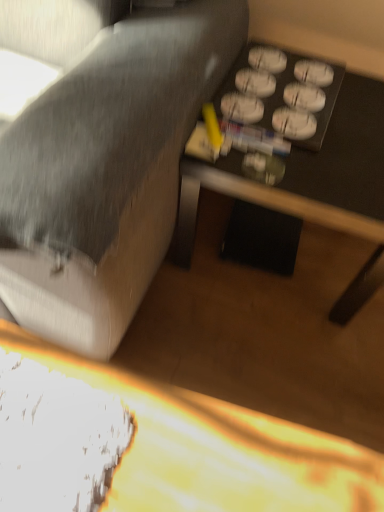
Identify the location of free space above wooden table at center, which is the second table from top to bottom (from a real-world perspective). This screenshot has height=512, width=384. (209, 374).